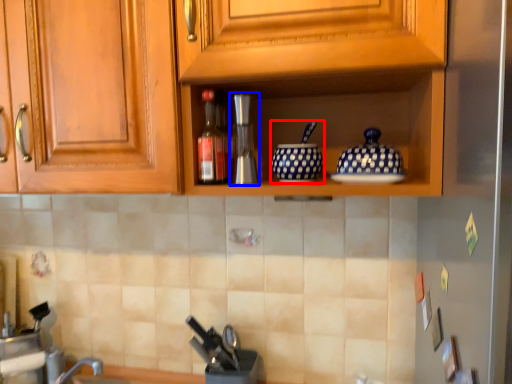
Question: Which object is further to the camera taking this photo, tableware (highlighted by a red box) or coffee machine (highlighted by a blue box)?

Choices:
 (A) tableware
 (B) coffee machine

Answer: (B)